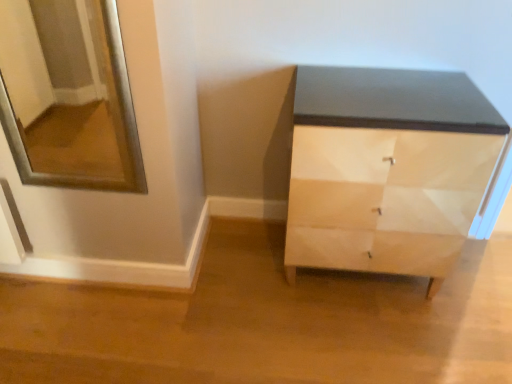
Question: From the image's perspective, is white glossy drawer at lower right located above or below matte black cabinet at center?

Choices:
 (A) below
 (B) above

Answer: (A)

Question: Considering the positions of white glossy drawer at lower right and matte black cabinet at center in the image, is white glossy drawer at lower right bigger or smaller than matte black cabinet at center?

Choices:
 (A) small
 (B) big

Answer: (A)

Question: Estimate the real-world distances between objects in this image. Which object is closer to the silver/metallic mirror at upper left?

Choices:
 (A) matte black cabinet at center
 (B) white glossy drawer at lower right

Answer: (A)

Question: Which of these objects is positioned closest to the matte black cabinet at center?

Choices:
 (A) white glossy drawer at lower right
 (B) silver/metallic mirror at upper left

Answer: (A)